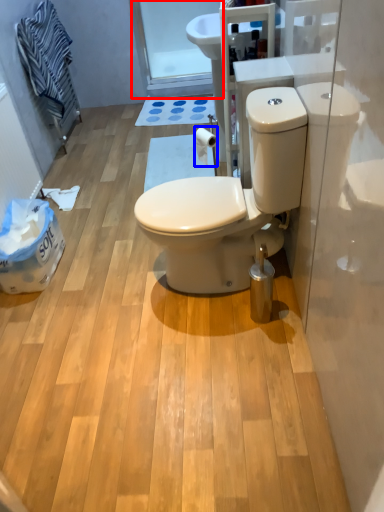
Question: Which object appears farthest to the camera in this image, glass door (highlighted by a red box) or toilet paper (highlighted by a blue box)?

Choices:
 (A) glass door
 (B) toilet paper

Answer: (A)